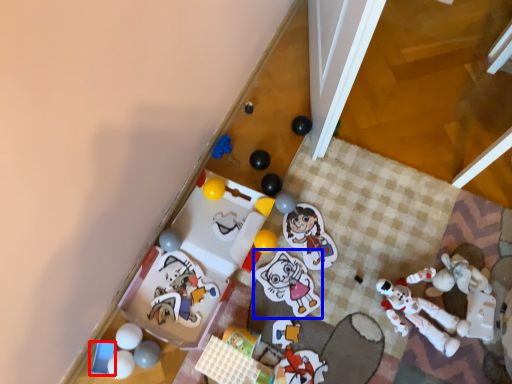
Question: Which object appears farthest to the camera in this image, toy (highlighted by a red box) or toy (highlighted by a blue box)?

Choices:
 (A) toy
 (B) toy

Answer: (B)